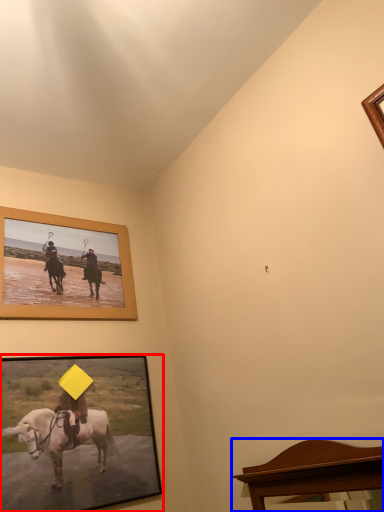
Question: Which object is closer to the camera taking this photo, picture frame (highlighted by a red box) or furniture (highlighted by a blue box)?

Choices:
 (A) picture frame
 (B) furniture

Answer: (B)